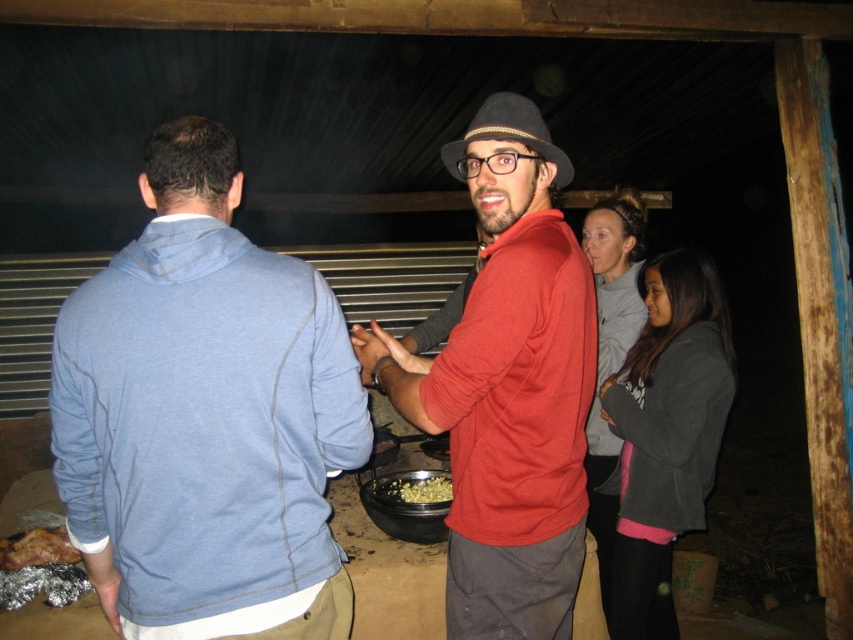
Between point (547, 540) and point (593, 403), which one is positioned in front?

Positioned in front is point (547, 540).

Is point (471, 337) behind point (608, 259)?

No, it is in front of (608, 259).

This screenshot has height=640, width=853. I want to click on matte red sweater at center, so click(x=508, y=387).

The height and width of the screenshot is (640, 853). What do you see at coordinates (665, 435) in the screenshot?
I see `dark gray fleece jacket at right` at bounding box center [665, 435].

Does dark gray fleece jacket at right appear over shiny silver foil at lower left?

Correct, dark gray fleece jacket at right is located above shiny silver foil at lower left.

This screenshot has width=853, height=640. What do you see at coordinates (665, 435) in the screenshot?
I see `dark gray fleece jacket at right` at bounding box center [665, 435].

Where is `dark gray fleece jacket at right`? dark gray fleece jacket at right is located at coordinates (665, 435).

Is blue fleece jacket at center further to the viewer compared to gray sweatshirt at right?

No.

Can you confirm if blue fleece jacket at center is taller than gray sweatshirt at right?

No.

This screenshot has width=853, height=640. In order to click on blue fleece jacket at center in this screenshot , I will do `click(206, 417)`.